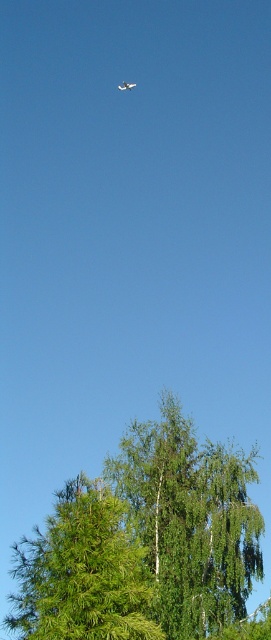
You are standing at the point labeled as point (191, 520) in the image. Looking around, you see a small airplane flying at the top center and a coniferous tree on the left. Which object is closer to your current position?

The point (191, 520) corresponds to the green leafy tree at center, so the coniferous tree on the left is closer to your current position.

You are a drone operator trying to navigate your drone through a forest. You see a point at coordinates (191, 520) where a green leafy tree is located. Can you fly your drone safely between the small airplane at top center and the green leafy tree at center without hitting either?

The green leafy tree at center is located at point (191, 520). Since the small airplane is at top center and the green leafy tree is at center, there is a vertical gap between them. The drone can safely fly between them as long as it maintains a path below the airplane and above the tree.